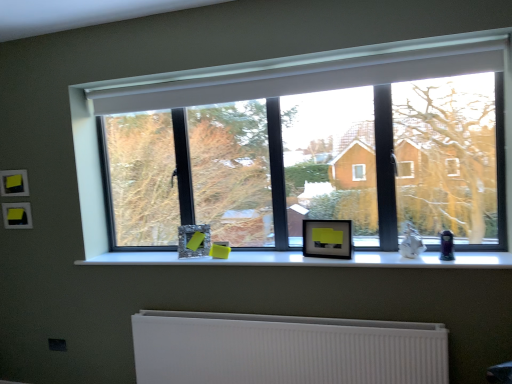
Question: In terms of size, does white matte window sill at center appear bigger or smaller than white ribbed radiator at lower center?

Choices:
 (A) small
 (B) big

Answer: (A)

Question: From a real-world perspective, relative to white ribbed radiator at lower center, is white matte window sill at center vertically above or below?

Choices:
 (A) below
 (B) above

Answer: (B)

Question: Based on their relative distances, which object is farther from the white ribbed radiator at lower center?

Choices:
 (A) black matte picture frame at center, which is the 2th picture frame in back-to-front order
 (B) transparent glass window at center
 (C) white matte window sill at center
 (D) matte glass picture frame at center, the 1th picture frame from the back

Answer: (B)

Question: Which object is positioned farthest from the black matte picture frame at center, which is the 2th picture frame in back-to-front order?

Choices:
 (A) transparent glass window at center
 (B) matte glass picture frame at center, the 1th picture frame from the back
 (C) white ribbed radiator at lower center
 (D) white matte window sill at center

Answer: (A)